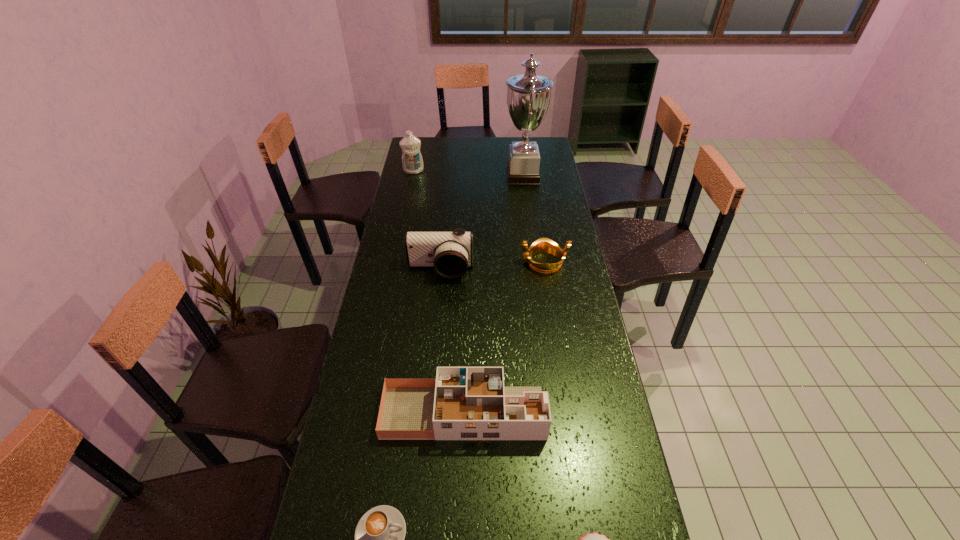
This screenshot has width=960, height=540. Find the location of `the tallest object`. the tallest object is located at coordinates (528, 95).

In order to click on detergent in this screenshot , I will do `click(412, 162)`.

This screenshot has width=960, height=540. Find the location of `the third tallest object`. the third tallest object is located at coordinates (450, 253).

Where is `tiara`? This screenshot has height=540, width=960. tiara is located at coordinates (543, 245).

This screenshot has width=960, height=540. In order to click on dollhouse in this screenshot , I will do `click(468, 403)`.

Where is `blank area located at the front view of the tallest object`? blank area located at the front view of the tallest object is located at coordinates (427, 176).

The width and height of the screenshot is (960, 540). In order to click on free location located at the front view of the tallest object in this screenshot , I will do `click(476, 176)`.

Identify the location of vacant space located 0.350m at the front view of the tallest object. Image resolution: width=960 pixels, height=540 pixels. (431, 176).

The image size is (960, 540). What are the coordinates of `free space located on the back of the detergent` in the screenshot? It's located at (419, 146).

Locate an element on the screen. The width and height of the screenshot is (960, 540). vacant space located 0.150m on the surface of the third tallest object is located at coordinates coord(437,313).